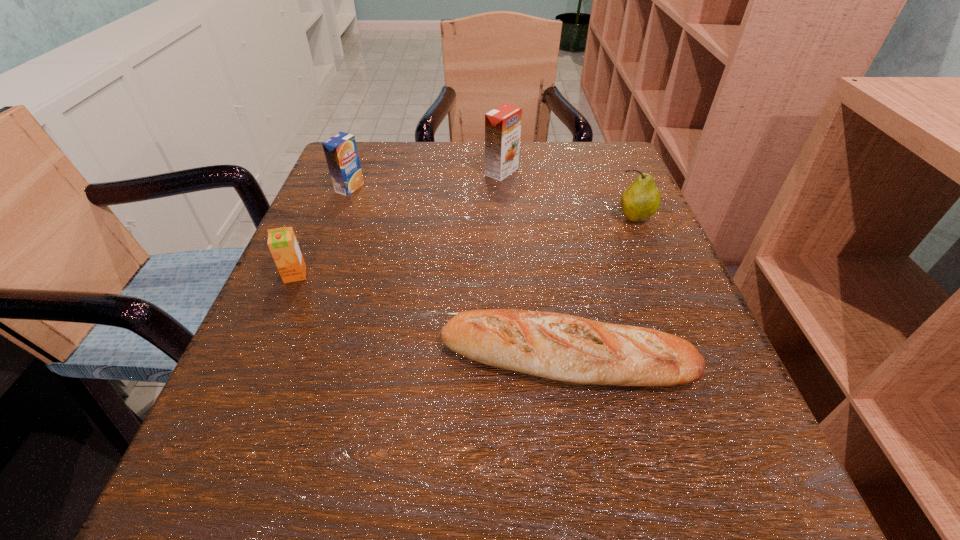
Image resolution: width=960 pixels, height=540 pixels. Identify the location of orange juice that is the second closest to the third nearest object. (340, 150).